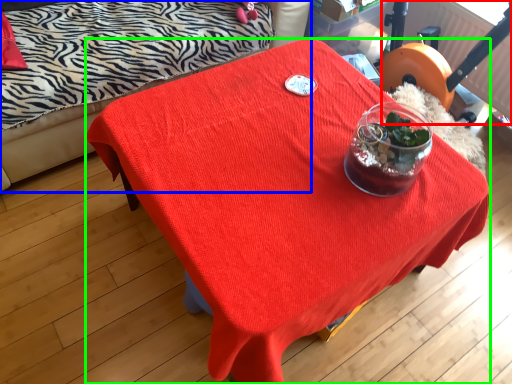
Question: Considering the real-world distances, which object is closest to swivel chair (highlighted by a red box)? studio couch (highlighted by a blue box) or desk (highlighted by a green box).

Choices:
 (A) studio couch
 (B) desk

Answer: (B)